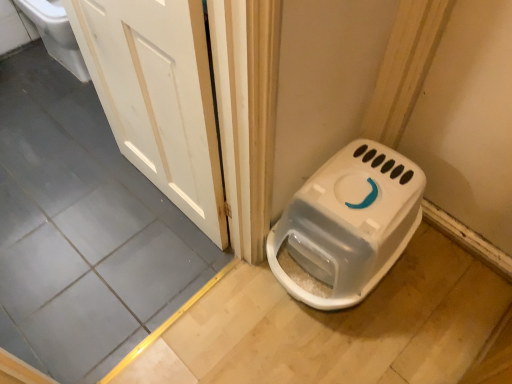
Question: Should I look upward or downward to see white plastic litter box at lower right?

Choices:
 (A) up
 (B) down

Answer: (B)

Question: From a real-world perspective, does white plastic litter box at lower right stand above white wood door at upper left?

Choices:
 (A) no
 (B) yes

Answer: (A)

Question: From the image's perspective, is white plastic litter box at lower right located above white wood door at upper left?

Choices:
 (A) yes
 (B) no

Answer: (B)

Question: Considering the relative sizes of white plastic litter box at lower right and white wood door at upper left in the image provided, is white plastic litter box at lower right wider than white wood door at upper left?

Choices:
 (A) no
 (B) yes

Answer: (B)

Question: Does white plastic litter box at lower right have a larger size compared to white wood door at upper left?

Choices:
 (A) yes
 (B) no

Answer: (A)

Question: From a real-world perspective, does white plastic litter box at lower right sit lower than white wood door at upper left?

Choices:
 (A) yes
 (B) no

Answer: (A)

Question: From the image's perspective, does white plastic litter box at lower right appear lower than white wood door at upper left?

Choices:
 (A) yes
 (B) no

Answer: (A)

Question: Considering the relative sizes of white wood door at upper left and white plastic litter box at lower right in the image provided, is white wood door at upper left wider than white plastic litter box at lower right?

Choices:
 (A) yes
 (B) no

Answer: (B)

Question: Is there a large distance between white wood door at upper left and white plastic litter box at lower right?

Choices:
 (A) yes
 (B) no

Answer: (B)

Question: Does white wood door at upper left come behind white plastic litter box at lower right?

Choices:
 (A) no
 (B) yes

Answer: (A)

Question: Is white wood door at upper left to the right of white plastic litter box at lower right from the viewer's perspective?

Choices:
 (A) no
 (B) yes

Answer: (A)

Question: Is white wood door at upper left not inside white plastic litter box at lower right?

Choices:
 (A) no
 (B) yes

Answer: (B)

Question: From a real-world perspective, is white wood door at upper left located beneath white plastic litter box at lower right?

Choices:
 (A) yes
 (B) no

Answer: (B)

Question: From the image's perspective, is white wood door at upper left located above or below white plastic litter box at lower right?

Choices:
 (A) below
 (B) above

Answer: (B)